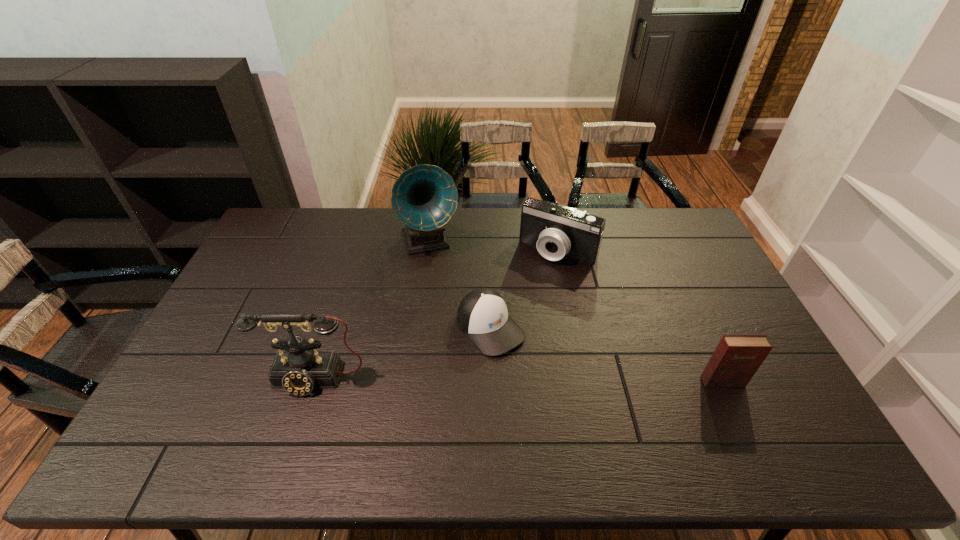
You are a GUI agent. You are given a task and a screenshot of the screen. Output one action in this format:
    pyautogui.click(x=<x>, y=<y>)
    Task: Click on the object that is positioned at the near edge
    The image size is (960, 540).
    Given the screenshot: What is the action you would take?
    pyautogui.click(x=299, y=369)

Image resolution: width=960 pixels, height=540 pixels. I want to click on object situated at the right edge, so click(736, 359).

The height and width of the screenshot is (540, 960). Find the location of `vacant space at the far edge`. vacant space at the far edge is located at coordinates (368, 219).

This screenshot has width=960, height=540. I want to click on vacant area at the near edge of the desktop, so click(x=301, y=409).

Where is `free location at the left edge of the desktop`? This screenshot has height=540, width=960. free location at the left edge of the desktop is located at coordinates (228, 368).

Where is `vacant space at the right edge of the desktop`? The height and width of the screenshot is (540, 960). vacant space at the right edge of the desktop is located at coordinates (749, 324).

In the image, there is a desktop. Where is `vacant space at the far right corner`? vacant space at the far right corner is located at coordinates (643, 208).

At what (x,y) coordinates should I click in order to perform the action: click on free point between the diary and the phonograph_record. Please return your answer as a coordinate pair (x, y). Looking at the image, I should click on (576, 312).

In order to click on free point between the diary and the second object from right to left in this screenshot , I will do `click(640, 316)`.

The width and height of the screenshot is (960, 540). Find the location of `unoccupied position between the third nearest object and the fourth object from left to right`. unoccupied position between the third nearest object and the fourth object from left to right is located at coordinates (524, 289).